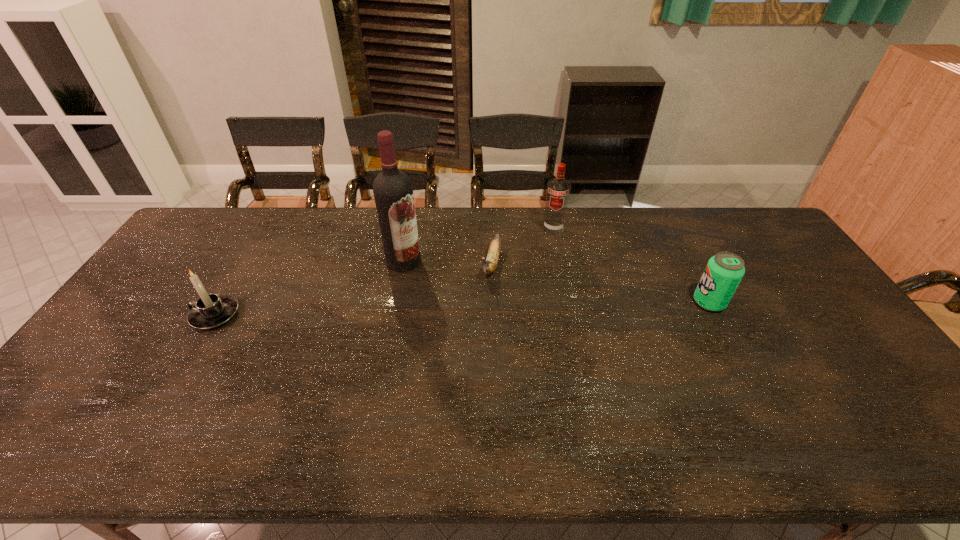
You are a GUI agent. You are given a task and a screenshot of the screen. Output one action in this format:
    pyautogui.click(x=<x>, y=<y>)
    Task: Click on the vacant spot on the desktop that is between the candle holder and the rightmost object and is positioned on the label of the wine bottle
    
    Given the screenshot: What is the action you would take?
    pyautogui.click(x=439, y=309)

At what (x,y) coordinates should I click in order to perform the action: click on vacant spot on the desktop that is between the candle holder and the rightmost object and is positioned on the front label of the farthest object. Please return your answer as a coordinate pair (x, y). This screenshot has width=960, height=540. Looking at the image, I should click on (537, 307).

You are a GUI agent. You are given a task and a screenshot of the screen. Output one action in this format:
    pyautogui.click(x=<x>, y=<y>)
    Task: Click on the vacant spot on the desktop that is between the leftmost object and the pop soda and is positioned on the peel of the shortest object
    The width and height of the screenshot is (960, 540).
    Given the screenshot: What is the action you would take?
    pyautogui.click(x=477, y=308)